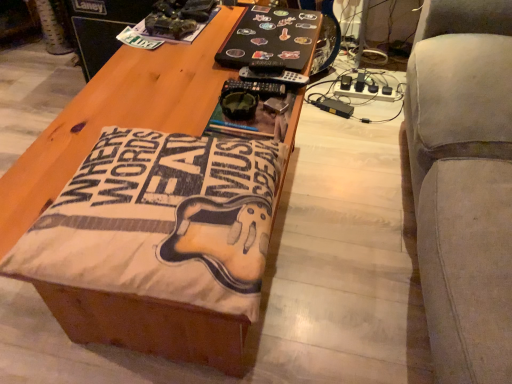
Question: Is beige fabric couch at right smaller than wooden table at center?

Choices:
 (A) no
 (B) yes

Answer: (A)

Question: From a real-world perspective, is beige fabric couch at right over wooden table at center?

Choices:
 (A) no
 (B) yes

Answer: (A)

Question: Does beige fabric couch at right have a lesser width compared to wooden table at center?

Choices:
 (A) yes
 (B) no

Answer: (B)

Question: Does beige fabric couch at right have a greater width compared to wooden table at center?

Choices:
 (A) no
 (B) yes

Answer: (B)

Question: Is the depth of beige fabric couch at right less than that of wooden table at center?

Choices:
 (A) yes
 (B) no

Answer: (A)

Question: From a real-world perspective, is beige fabric couch at right beneath wooden table at center?

Choices:
 (A) yes
 (B) no

Answer: (A)

Question: Considering the relative sizes of wooden table at center and beige fabric couch at right in the image provided, is wooden table at center taller than beige fabric couch at right?

Choices:
 (A) no
 (B) yes

Answer: (A)

Question: Considering the relative positions of wooden table at center and beige fabric couch at right in the image provided, is wooden table at center to the right of beige fabric couch at right from the viewer's perspective?

Choices:
 (A) no
 (B) yes

Answer: (A)

Question: Considering the relative sizes of wooden table at center and beige fabric couch at right in the image provided, is wooden table at center wider than beige fabric couch at right?

Choices:
 (A) no
 (B) yes

Answer: (A)

Question: Would you say wooden table at center is outside beige fabric couch at right?

Choices:
 (A) no
 (B) yes

Answer: (B)

Question: Is wooden table at center facing away from beige fabric couch at right?

Choices:
 (A) no
 (B) yes

Answer: (B)

Question: Considering the relative sizes of wooden table at center and beige fabric couch at right in the image provided, is wooden table at center thinner than beige fabric couch at right?

Choices:
 (A) no
 (B) yes

Answer: (B)

Question: From their relative heights in the image, would you say wooden table at center is taller or shorter than beige fabric couch at right?

Choices:
 (A) short
 (B) tall

Answer: (A)